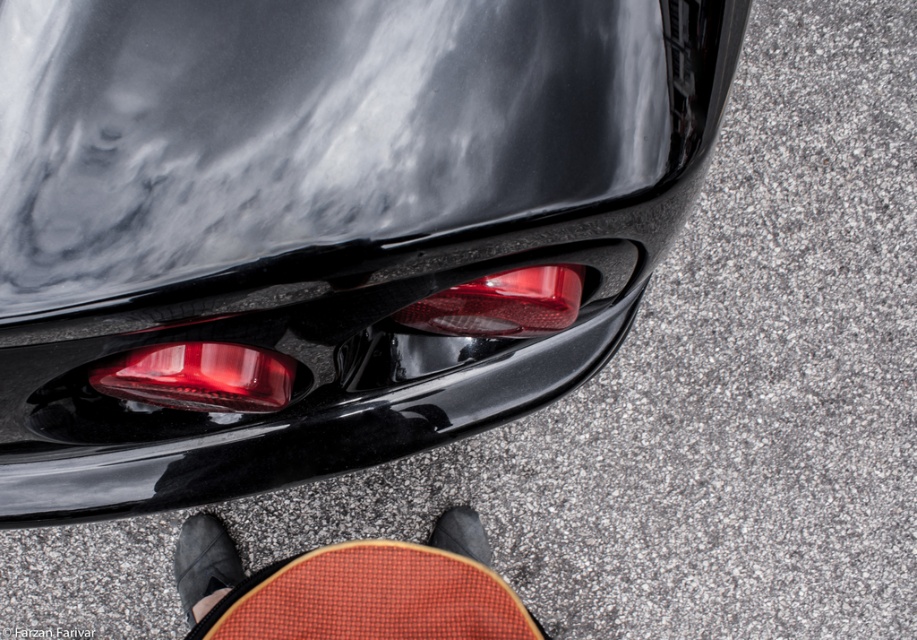
Can you confirm if glossy black taillight at center is shorter than black leather shoe at lower center?

No, glossy black taillight at center is not shorter than black leather shoe at lower center.

Looking at this image, does glossy black taillight at center appear under black leather shoe at lower center?

Incorrect, glossy black taillight at center is not positioned below black leather shoe at lower center.

Does point (92, 346) come closer to viewer compared to point (473, 548)?

Yes, point (92, 346) is closer to viewer.

Where is `glossy black taillight at center`? The height and width of the screenshot is (640, 917). glossy black taillight at center is located at coordinates (321, 218).

Who is positioned more to the right, black suede shoe at lower center or black leather shoe at lower center?

From the viewer's perspective, black leather shoe at lower center appears more on the right side.

How distant is black suede shoe at lower center from black leather shoe at lower center?

17.46 inches

Is point (179, 532) positioned behind point (481, 550)?

Yes, it is behind point (481, 550).

Identify the location of black suede shoe at lower center. The image size is (917, 640). (204, 564).

At what (x,y) coordinates should I click in order to perform the action: click on textured brown skateboard at lower center. Please return your answer as a coordinate pair (x, y). The height and width of the screenshot is (640, 917). Looking at the image, I should click on (351, 588).

Is textured brown skateboard at lower center shorter than black leather shoe at lower center?

Indeed, textured brown skateboard at lower center has a lesser height compared to black leather shoe at lower center.

Who is more forward, (344, 550) or (476, 529)?

Point (344, 550) is in front.

Locate an element on the screen. textured brown skateboard at lower center is located at coordinates (351, 588).